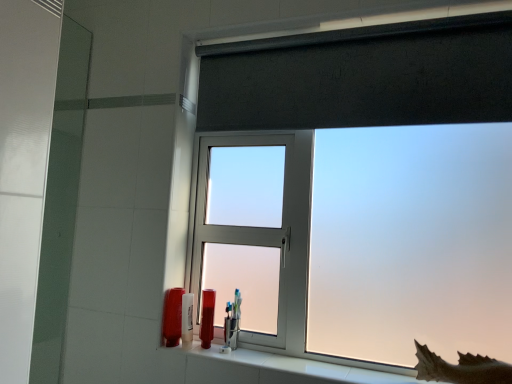
Locate an element on the screen. vacant area situated below black textured roller blind at upper center (from a real-world perspective) is located at coordinates (303, 357).